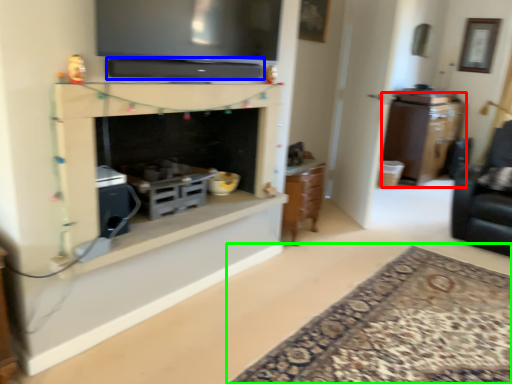
Question: Which object is positioned closest to cabinetry (highlighted by a red box)? Select from appliance (highlighted by a blue box) and plain (highlighted by a green box).

Choices:
 (A) appliance
 (B) plain

Answer: (B)